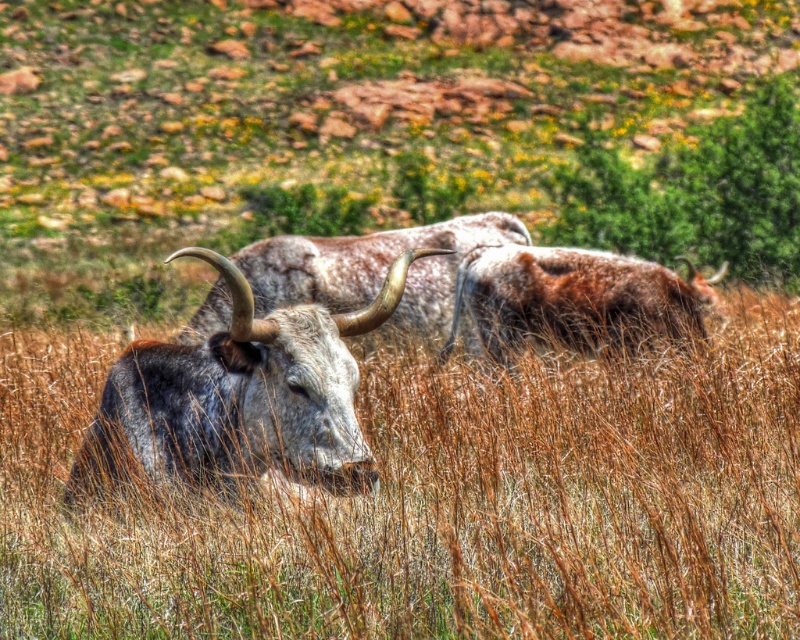
Based on the photo, you are a photographer trying to capture a closeup of the speckled gray cow at center. However, the brown grass at center is blocking your view. Can you estimate if the grass is wider than the cow, making it harder to frame the shot?

The brown grass at center has a larger width than the speckled gray cow at center, so the grass is indeed wider and may obstruct the view of the cow, making it challenging to frame the shot.

You are standing at the point marked with coordinates (440, 502) in the image. Looking around, you see brown grass at center. What is directly beneath your feet?

The point marked at coordinates (440, 502) is directly on the brown grass at center.